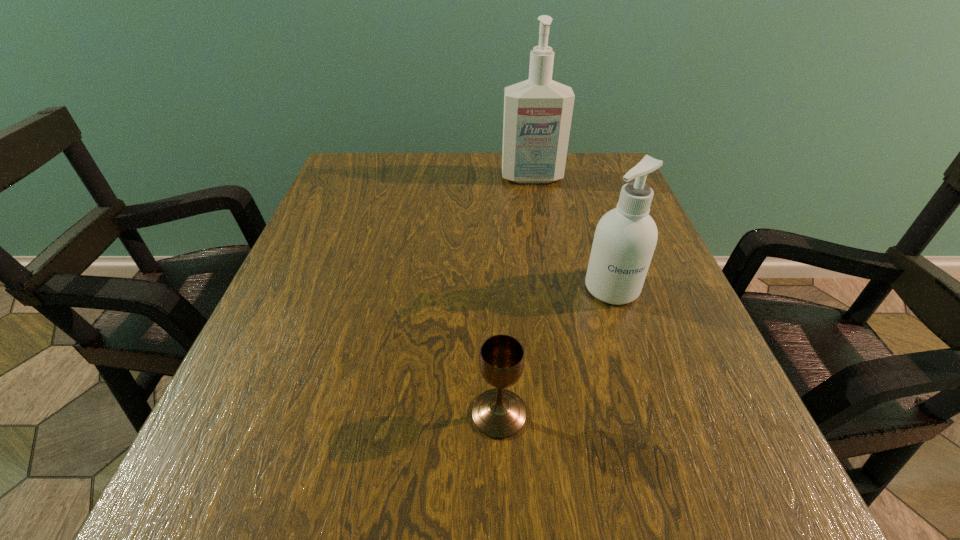
Identify the location of the farthest object. This screenshot has width=960, height=540. (538, 112).

You are a GUI agent. You are given a task and a screenshot of the screen. Output one action in this format:
    pyautogui.click(x=<x>, y=<y>)
    Task: Click on the taller cleansing agent
    The height and width of the screenshot is (540, 960).
    Given the screenshot: What is the action you would take?
    pyautogui.click(x=538, y=112)

The height and width of the screenshot is (540, 960). I want to click on the second shortest object, so click(x=625, y=238).

At what (x,y) coordinates should I click in order to perform the action: click on the second farthest object. Please return your answer as a coordinate pair (x, y). Image resolution: width=960 pixels, height=540 pixels. Looking at the image, I should click on (625, 238).

In order to click on the shortest object in this screenshot , I will do `click(498, 413)`.

Locate an element on the screen. chalice is located at coordinates (498, 413).

Image resolution: width=960 pixels, height=540 pixels. I want to click on vacant space located 0.240m on the front label of the farther cleansing agent, so click(544, 249).

At what (x,y) coordinates should I click in order to perform the action: click on vacant space located on the front label of the second tallest object. Please return your answer as a coordinate pair (x, y). This screenshot has width=960, height=540. Looking at the image, I should click on (628, 339).

Identify the location of free space located 0.080m on the right of the shortest object. The image size is (960, 540). (584, 414).

The height and width of the screenshot is (540, 960). In order to click on object at the far edge in this screenshot , I will do `click(538, 112)`.